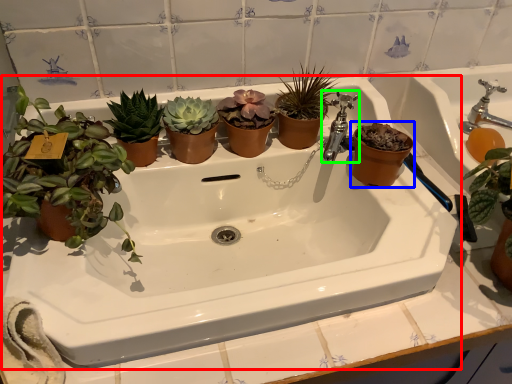
Question: Estimate the real-world distances between objects in this image. Which object is closer to sink (highlighted by a red box), flowerpot (highlighted by a blue box) or tap (highlighted by a green box)?

Choices:
 (A) flowerpot
 (B) tap

Answer: (A)